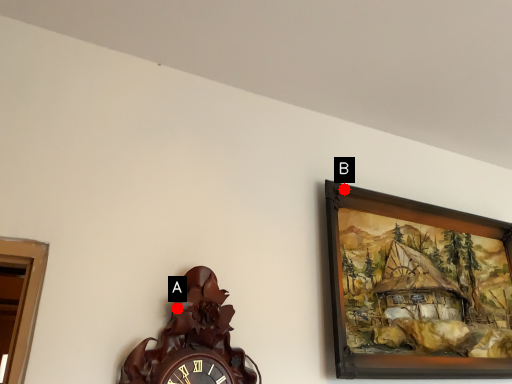
Question: Two points are circled on the image, labeled by A and B beside each circle. Which point is further to the camera?

Choices:
 (A) A is further
 (B) B is further

Answer: (B)